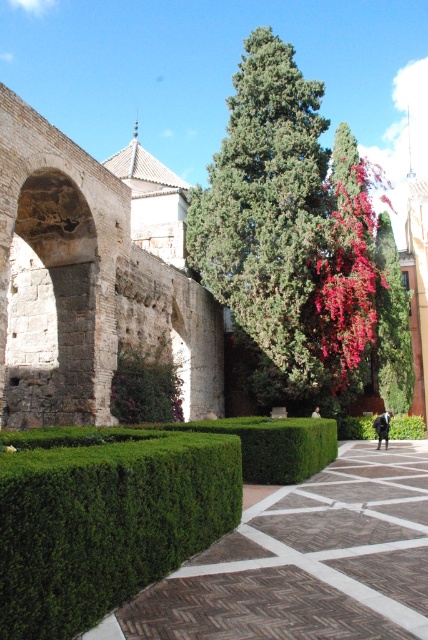
You are standing at the entrance of the garden and see two points marked in the image. The first point is at coordinate point (x=320, y=209) and the second is at point (x=392, y=291). Which point is nearer to you?

Point (x=320, y=209) is closer to the viewer than point (x=392, y=291).

You are standing in the garden and see the point marked at coordinates (267, 216). What object is located at that point?

The point at coordinates (267, 216) corresponds to the green textured tree at center.

You are standing in the garden and want to take a photo of both the green hedge at lower left and the green textured tree at center. Which object should you focus on first to ensure both are in the frame?

You should focus on the green hedge at lower left first because it is closer to you than the green textured tree at center, ensuring both are in the frame.